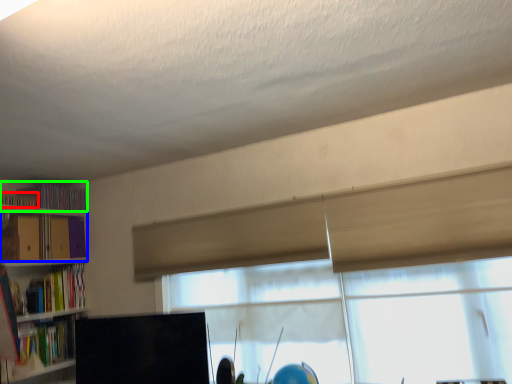
Question: Which object is positioned farthest from book (highlighted by a red box)? Select from book (highlighted by a blue box) and book (highlighted by a green box).

Choices:
 (A) book
 (B) book

Answer: (A)